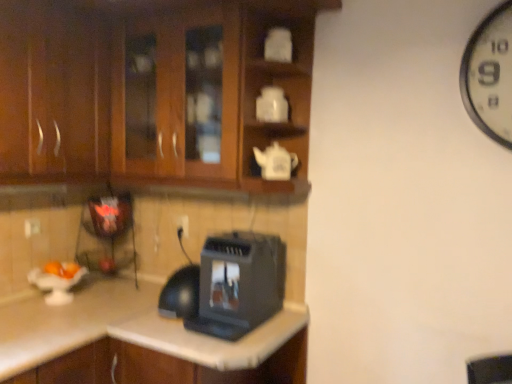
Question: From a real-world perspective, is white plastic electric outlet at center over black plastic toaster at lower center?

Choices:
 (A) yes
 (B) no

Answer: (A)

Question: Is black plastic toaster at lower center located within white plastic electric outlet at center?

Choices:
 (A) yes
 (B) no

Answer: (B)

Question: Is white plastic electric outlet at center closer to camera compared to black plastic toaster at lower center?

Choices:
 (A) yes
 (B) no

Answer: (B)

Question: Considering the relative positions of white plastic electric outlet at center and black plastic toaster at lower center in the image provided, is white plastic electric outlet at center to the left of black plastic toaster at lower center from the viewer's perspective?

Choices:
 (A) no
 (B) yes

Answer: (B)

Question: Considering the relative sizes of white plastic electric outlet at center and black plastic toaster at lower center in the image provided, is white plastic electric outlet at center bigger than black plastic toaster at lower center?

Choices:
 (A) no
 (B) yes

Answer: (A)

Question: Is white plastic electric outlet at center not near black plastic toaster at lower center?

Choices:
 (A) yes
 (B) no

Answer: (B)

Question: Is black plastic toaster at lower center oriented away from brown wood cabinets at upper left, positioned as the 2th cabinetry in left-to-right order?

Choices:
 (A) yes
 (B) no

Answer: (B)

Question: Can you confirm if black plastic toaster at lower center is thinner than brown wood cabinets at upper left, positioned as the 2th cabinetry in left-to-right order?

Choices:
 (A) yes
 (B) no

Answer: (A)

Question: Could you tell me if black plastic toaster at lower center is turned towards brown wood cabinets at upper left, the first cabinetry in the right-to-left sequence?

Choices:
 (A) yes
 (B) no

Answer: (B)

Question: Are black plastic toaster at lower center and brown wood cabinets at upper left, the first cabinetry in the right-to-left sequence, far apart?

Choices:
 (A) yes
 (B) no

Answer: (B)

Question: Does black plastic toaster at lower center have a smaller size compared to brown wood cabinets at upper left, the first cabinetry in the right-to-left sequence?

Choices:
 (A) no
 (B) yes

Answer: (B)

Question: Considering the relative sizes of black plastic toaster at lower center and brown wood cabinets at upper left, positioned as the 2th cabinetry in left-to-right order, in the image provided, is black plastic toaster at lower center bigger than brown wood cabinets at upper left, positioned as the 2th cabinetry in left-to-right order,?

Choices:
 (A) yes
 (B) no

Answer: (B)

Question: From a real-world perspective, is black plastic toaster at lower center positioned over white plastic electric outlet at center based on gravity?

Choices:
 (A) yes
 (B) no

Answer: (B)